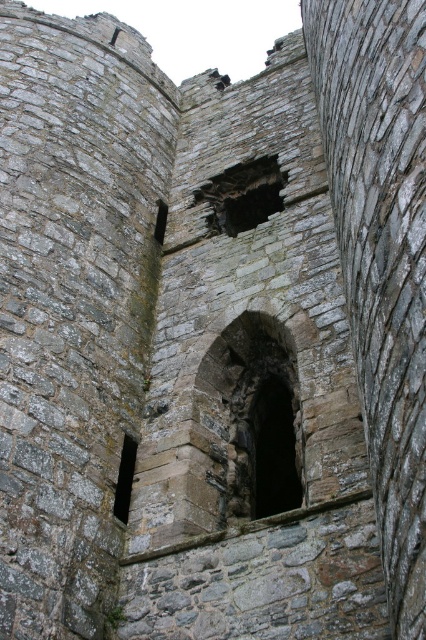
Is dark stone hole at center bigger than dark stone window at lower left?

Yes, dark stone hole at center is bigger than dark stone window at lower left.

Does dark stone hole at center appear on the right side of dark stone window at lower left?

Indeed, dark stone hole at center is positioned on the right side of dark stone window at lower left.

Does point (279, 179) come behind point (123, 500)?

Yes, it is behind point (123, 500).

You are a GUI agent. You are given a task and a screenshot of the screen. Output one action in this format:
    pyautogui.click(x=<x>, y=<y>)
    Task: Click on the dark stone hole at center
    The width and height of the screenshot is (426, 640).
    Given the screenshot: What is the action you would take?
    pyautogui.click(x=241, y=195)

Can you confirm if rough stone archway at center is thinner than dark stone hole at center?

Yes.

Who is positioned more to the right, rough stone archway at center or dark stone hole at center?

rough stone archway at center is more to the right.

Does point (268, 433) come closer to viewer compared to point (215, 230)?

Yes.

In order to click on rough stone archway at center in this screenshot , I will do `click(250, 419)`.

The height and width of the screenshot is (640, 426). Describe the element at coordinates (250, 419) in the screenshot. I see `rough stone archway at center` at that location.

Is rough stone archway at center in front of dark stone window at lower left?

Yes, rough stone archway at center is in front of dark stone window at lower left.

Between point (282, 460) and point (120, 465), which one is positioned in front?

Point (120, 465)

Locate an element on the screen. Image resolution: width=426 pixels, height=640 pixels. rough stone archway at center is located at coordinates (250, 419).